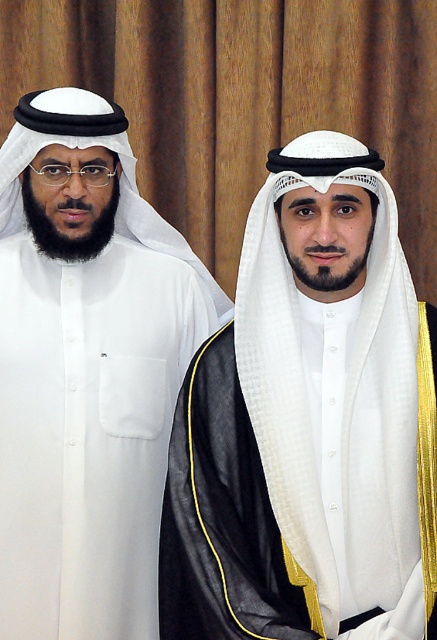
Is white matte headscarf at center below white matte kandura at left?

Correct, white matte headscarf at center is located below white matte kandura at left.

Can you confirm if white matte headscarf at center is wider than white matte kandura at left?

Indeed, white matte headscarf at center has a greater width compared to white matte kandura at left.

At what (x,y) coordinates should I click in order to perform the action: click on white matte headscarf at center. Please return your answer as a coordinate pair (x, y). The image size is (437, 640). Looking at the image, I should click on (308, 424).